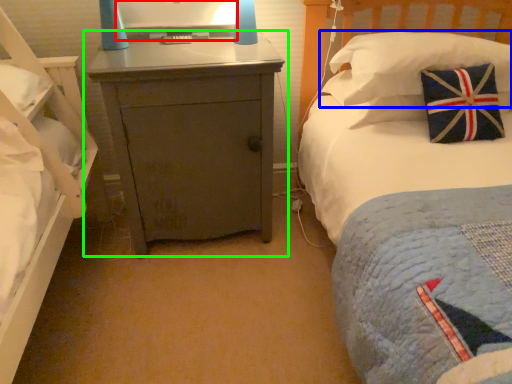
Question: Considering the real-world distances, which object is farthest from computer monitor (highlighted by a red box)? pillow (highlighted by a blue box) or nightstand (highlighted by a green box)?

Choices:
 (A) pillow
 (B) nightstand

Answer: (A)